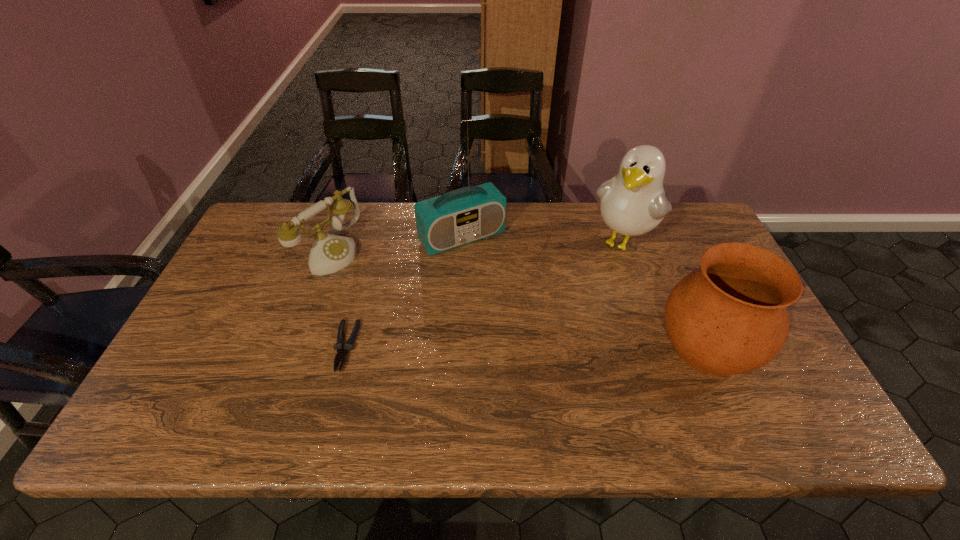
Image resolution: width=960 pixels, height=540 pixels. In order to click on pliers that is positioned at the near edge in this screenshot , I will do `click(348, 346)`.

Locate an element on the screen. This screenshot has height=540, width=960. pottery at the near edge is located at coordinates (730, 317).

This screenshot has width=960, height=540. What are the coordinates of `object that is at the right edge` in the screenshot? It's located at (730, 317).

The width and height of the screenshot is (960, 540). Identify the location of object present at the near right corner. (730, 317).

Locate an element on the screen. This screenshot has width=960, height=540. free space at the far edge of the desktop is located at coordinates (468, 248).

This screenshot has height=540, width=960. In the image, there is a desktop. What are the coordinates of `vacant space at the near edge` in the screenshot? It's located at pos(711,376).

Where is `vacant space at the far left corner`? vacant space at the far left corner is located at coordinates (268, 233).

In the image, there is a desktop. At what (x,y) coordinates should I click in order to perform the action: click on free region at the near left corner. Please return your answer as a coordinate pair (x, y). Looking at the image, I should click on (210, 395).

Where is `free spot at the far right corner of the desktop`? free spot at the far right corner of the desktop is located at coordinates (695, 205).

The image size is (960, 540). I want to click on free space at the near right corner, so pos(760,387).